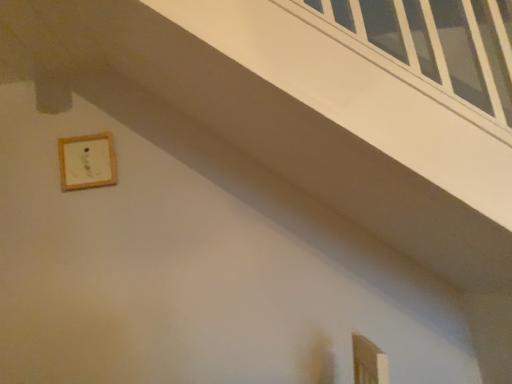
Identify the location of wooden frame at upper left. The width and height of the screenshot is (512, 384). (87, 161).

The height and width of the screenshot is (384, 512). Describe the element at coordinates (87, 161) in the screenshot. I see `wooden frame at upper left` at that location.

Where is `wooden frame at upper left`? This screenshot has width=512, height=384. wooden frame at upper left is located at coordinates (87, 161).